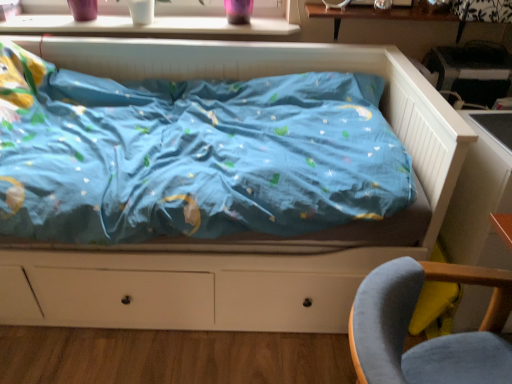
In order to click on white glossy window sill at upper center in this screenshot , I will do `click(150, 27)`.

Find the location of a particular element. velvet grey chair at lower right is located at coordinates (407, 332).

Describe the element at coordinates (243, 235) in the screenshot. The height and width of the screenshot is (384, 512). I see `matte blue bed at center` at that location.

The width and height of the screenshot is (512, 384). I want to click on wooden table at upper center, the 1th table from the top, so click(382, 15).

From the picture: From the image's perspective, does matte blue bed at center appear lower than wooden table at upper center, the 1th table from the top?

Yes.

Who is taller, matte blue bed at center or wooden table at upper center, which is counted as the 2th table, starting from the bottom?

matte blue bed at center is taller.

Is matte blue bed at center aimed at wooden table at upper center, which is counted as the 2th table, starting from the bottom?

No, matte blue bed at center is not facing towards wooden table at upper center, which is counted as the 2th table, starting from the bottom.

Would you consider matte blue bed at center to be distant from velvet grey chair at lower right?

No, there isn't a large distance between matte blue bed at center and velvet grey chair at lower right.

Would you say matte blue bed at center is to the left or to the right of velvet grey chair at lower right in the picture?

matte blue bed at center is to the left of velvet grey chair at lower right.

From the image's perspective, does matte blue bed at center appear higher than velvet grey chair at lower right?

Yes, from the image's perspective, matte blue bed at center is on top of velvet grey chair at lower right.

Is white glossy window sill at upper center completely or partially outside of matte blue bed at center?

Absolutely, white glossy window sill at upper center is external to matte blue bed at center.

Which point is more forward, (200,30) or (67,289)?

The point (67,289) is closer to the camera.

From the image's perspective, is white glossy window sill at upper center positioned above or below matte blue bed at center?

white glossy window sill at upper center is above matte blue bed at center.

Does point (103, 27) appear closer or farther from the camera than point (504, 244)?

Point (103, 27) is positioned farther from the camera compared to point (504, 244).

Is white glossy window sill at upper center outside of white wood table at right, positioned as the first table in bottom-to-top order?

Yes.

Which is more to the right, white glossy window sill at upper center or white wood table at right, positioned as the first table in bottom-to-top order?

white wood table at right, positioned as the first table in bottom-to-top order.

Between white glossy window sill at upper center and white wood table at right, which ranks as the second table in top-to-bottom order, which one has less height?

Standing shorter between the two is white glossy window sill at upper center.

Based on the photo, from the image's perspective, is matte blue bed at center under white wood table at right, positioned as the first table in bottom-to-top order?

Actually, matte blue bed at center appears above white wood table at right, positioned as the first table in bottom-to-top order, in the image.

Is matte blue bed at center spatially inside white wood table at right, positioned as the first table in bottom-to-top order, or outside of it?

matte blue bed at center cannot be found inside white wood table at right, positioned as the first table in bottom-to-top order.

Which is behind, point (98, 49) or point (508, 176)?

The point (98, 49) is behind.

Does matte blue bed at center have a smaller size compared to white wood table at right, positioned as the first table in bottom-to-top order?

No.

Can white glossy window sill at upper center be found inside matte blue bed at center?

Definitely not — white glossy window sill at upper center is not inside matte blue bed at center.

Who is smaller, matte blue bed at center or white glossy window sill at upper center?

With smaller size is white glossy window sill at upper center.

From the image's perspective, is matte blue bed at center under white glossy window sill at upper center?

Yes, from the image's perspective, matte blue bed at center is below white glossy window sill at upper center.

Where is `bed that is under the white glossy window sill at upper center (from a real-world perspective)`? The height and width of the screenshot is (384, 512). bed that is under the white glossy window sill at upper center (from a real-world perspective) is located at coordinates (243, 235).

The image size is (512, 384). Identify the location of table that appears behind the white wood table at right, which ranks as the second table in top-to-bottom order. 382,15.

Is white wood table at right, positioned as the first table in bottom-to-top order, positioned beyond the bounds of wooden table at upper center, the 1th table from the top?

Yes, white wood table at right, positioned as the first table in bottom-to-top order, is not within wooden table at upper center, the 1th table from the top.

Based on the photo, which is closer, (497,178) or (337,27)?

Point (497,178) is positioned closer to the camera compared to point (337,27).

Considering the relative sizes of white wood table at right, which ranks as the second table in top-to-bottom order, and wooden table at upper center, the 1th table from the top, in the image provided, is white wood table at right, which ranks as the second table in top-to-bottom order, taller than wooden table at upper center, the 1th table from the top,?

Indeed, white wood table at right, which ranks as the second table in top-to-bottom order, has a greater height compared to wooden table at upper center, the 1th table from the top.

The image size is (512, 384). I want to click on table positioned vertically above the matte blue bed at center (from a real-world perspective), so click(382, 15).

The height and width of the screenshot is (384, 512). What are the coordinates of `chair lying in front of the matte blue bed at center` in the screenshot? It's located at (407, 332).

Based on their spatial positions, is velvet grey chair at lower right or matte blue bed at center further from white wood table at right, which ranks as the second table in top-to-bottom order?

Based on the image, matte blue bed at center appears to be further to white wood table at right, which ranks as the second table in top-to-bottom order.

When comparing their distances from white wood table at right, which ranks as the second table in top-to-bottom order, does matte blue bed at center or wooden table at upper center, the 1th table from the top, seem closer?

Among the two, matte blue bed at center is located nearer to white wood table at right, which ranks as the second table in top-to-bottom order.

Based on their spatial positions, is wooden table at upper center, the 1th table from the top, or velvet grey chair at lower right closer to white wood table at right, which ranks as the second table in top-to-bottom order?

velvet grey chair at lower right is closer to white wood table at right, which ranks as the second table in top-to-bottom order.

Based on their spatial positions, is white wood table at right, positioned as the first table in bottom-to-top order, or white glossy window sill at upper center further from wooden table at upper center, which is counted as the 2th table, starting from the bottom?

white wood table at right, positioned as the first table in bottom-to-top order.

Considering their positions, is white wood table at right, positioned as the first table in bottom-to-top order, positioned closer to matte blue bed at center than wooden table at upper center, the 1th table from the top?

Among the two, white wood table at right, positioned as the first table in bottom-to-top order, is located nearer to matte blue bed at center.

From the image, which object appears to be farther from matte blue bed at center, velvet grey chair at lower right or wooden table at upper center, which is counted as the 2th table, starting from the bottom?

The object further to matte blue bed at center is wooden table at upper center, which is counted as the 2th table, starting from the bottom.

Looking at the image, which one is located further to velvet grey chair at lower right, matte blue bed at center or white glossy window sill at upper center?

Among the two, white glossy window sill at upper center is located further to velvet grey chair at lower right.

Which object lies further to the anchor point white glossy window sill at upper center, matte blue bed at center or wooden table at upper center, the 1th table from the top?

matte blue bed at center.

Where is `table between matte blue bed at center and white wood table at right, which ranks as the second table in top-to-bottom order`? table between matte blue bed at center and white wood table at right, which ranks as the second table in top-to-bottom order is located at coordinates (382, 15).

Find the location of a particular element. chair located between white glossy window sill at upper center and white wood table at right, which ranks as the second table in top-to-bottom order, in the left-right direction is located at coordinates (407, 332).

Locate an element on the screen. This screenshot has width=512, height=384. table between white glossy window sill at upper center and white wood table at right, positioned as the first table in bottom-to-top order is located at coordinates (382, 15).

Where is `bed that lies between wooden table at upper center, which is counted as the 2th table, starting from the bottom, and velvet grey chair at lower right from top to bottom`? bed that lies between wooden table at upper center, which is counted as the 2th table, starting from the bottom, and velvet grey chair at lower right from top to bottom is located at coordinates click(x=243, y=235).